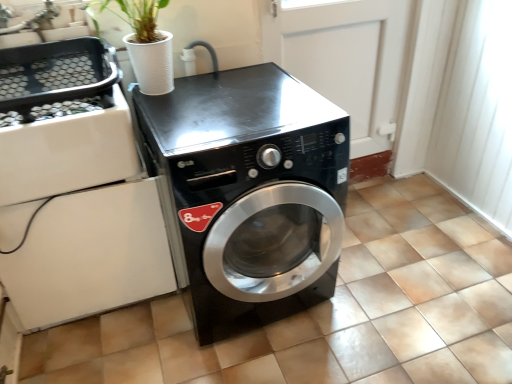
Find the location of a particular element. The image size is (512, 384). white glossy door at center is located at coordinates (345, 59).

This screenshot has width=512, height=384. What do you see at coordinates (345, 59) in the screenshot?
I see `white glossy door at center` at bounding box center [345, 59].

In order to face black glossy washing machine at center, should I rotate leftwards or rightwards?

It's best to rotate left around 1.649 degrees.

I want to click on black glossy washing machine at center, so click(250, 187).

What do you see at coordinates (250, 187) in the screenshot? The width and height of the screenshot is (512, 384). I see `black glossy washing machine at center` at bounding box center [250, 187].

What is the approximate width of black glossy washing machine at center?

It is 73.98 centimeters.

At what (x,y) coordinates should I click in order to perform the action: click on white glossy door at center. Please return your answer as a coordinate pair (x, y). The width and height of the screenshot is (512, 384). Looking at the image, I should click on (345, 59).

Between white glossy door at center and black glossy washing machine at center, which one appears on the left side from the viewer's perspective?

black glossy washing machine at center is more to the left.

Does white glossy door at center come behind black glossy washing machine at center?

That is True.

Considering the positions of points (324, 64) and (167, 145), is point (324, 64) closer to camera compared to point (167, 145)?

That is False.

From the image's perspective, which object appears higher, white glossy door at center or black glossy washing machine at center?

white glossy door at center, from the image's perspective.

From a real-world perspective, between white glossy door at center and black glossy washing machine at center, who is vertically lower?

black glossy washing machine at center, from a real-world perspective.

Is white glossy door at center thinner than black glossy washing machine at center?

Indeed, white glossy door at center has a lesser width compared to black glossy washing machine at center.

In terms of height, does white glossy door at center look taller or shorter compared to black glossy washing machine at center?

white glossy door at center is taller than black glossy washing machine at center.

Which of these two, white glossy door at center or black glossy washing machine at center, is smaller?

white glossy door at center is smaller.

Is white glossy door at center outside of black glossy washing machine at center?

Absolutely, white glossy door at center is external to black glossy washing machine at center.

Are white glossy door at center and black glossy washing machine at center making contact?

No, white glossy door at center is not making contact with black glossy washing machine at center.

In the scene shown: Is white glossy door at center oriented towards black glossy washing machine at center?

No, white glossy door at center is not oriented towards black glossy washing machine at center.

Measure the distance between white glossy door at center and black glossy washing machine at center.

white glossy door at center is 22.59 inches from black glossy washing machine at center.

Identify the location of washing machine located in front of the white glossy door at center. The width and height of the screenshot is (512, 384). (250, 187).

Which object is positioned more to the right, black glossy washing machine at center or white glossy door at center?

white glossy door at center.

Based on the photo, is black glossy washing machine at center further to camera compared to white glossy door at center?

That is False.

Is point (270, 310) closer to camera compared to point (380, 6)?

Yes, point (270, 310) is in front of point (380, 6).

From the picture: From the image's perspective, is black glossy washing machine at center beneath white glossy door at center?

Yes, from the image's perspective, black glossy washing machine at center is below white glossy door at center.

From a real-world perspective, is black glossy washing machine at center physically below white glossy door at center?

Yes, from a real-world perspective, black glossy washing machine at center is beneath white glossy door at center.

Is black glossy washing machine at center wider than white glossy door at center?

Correct, the width of black glossy washing machine at center exceeds that of white glossy door at center.

Can you confirm if black glossy washing machine at center is taller than white glossy door at center?

In fact, black glossy washing machine at center may be shorter than white glossy door at center.

Is black glossy washing machine at center bigger than white glossy door at center?

Yes.

Do you think black glossy washing machine at center is within white glossy door at center, or outside of it?

black glossy washing machine at center exists outside the volume of white glossy door at center.

In the scene shown: Is black glossy washing machine at center positioned far away from white glossy door at center?

No.

Is black glossy washing machine at center facing away from white glossy door at center?

No.

How different are the orientations of black glossy washing machine at center and white glossy door at center in degrees?

black glossy washing machine at center and white glossy door at center are facing 0.19 degrees away from each other.

How far apart are black glossy washing machine at center and white glossy door at center?

black glossy washing machine at center and white glossy door at center are 22.59 inches apart.

Locate an element on the screen. washing machine in front of the white glossy door at center is located at coordinates (250, 187).

You are a GUI agent. You are given a task and a screenshot of the screen. Output one action in this format:
    pyautogui.click(x=<x>, y=<y>)
    Task: Click on the washing machine below the white glossy door at center (from a real-world perspective)
    
    Given the screenshot: What is the action you would take?
    pyautogui.click(x=250, y=187)

The width and height of the screenshot is (512, 384). In order to click on washing machine on the left side of white glossy door at center in this screenshot , I will do `click(250, 187)`.